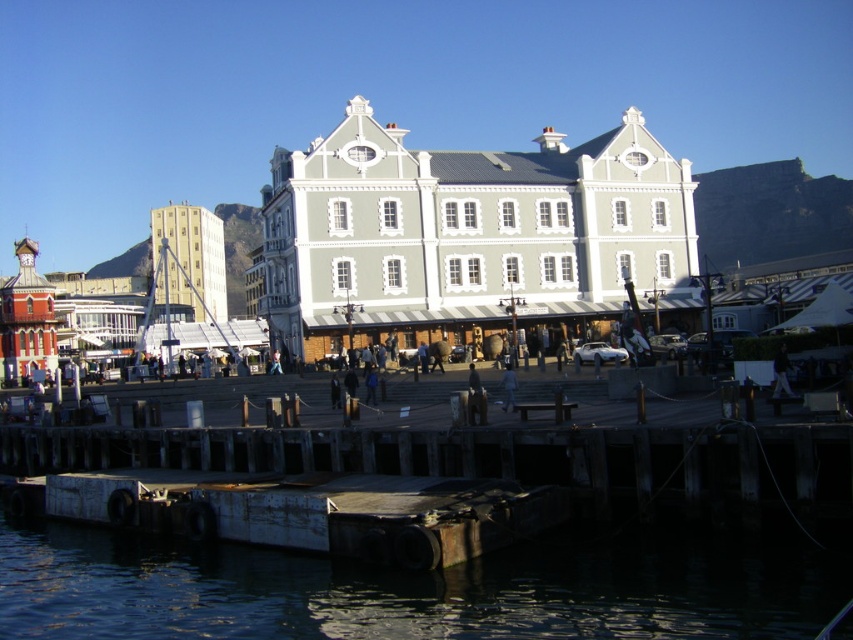
Which is below, dark gray water at lower left or rusty metal dock at lower center?

Positioned lower is dark gray water at lower left.

At what (x,y) coordinates should I click in order to perform the action: click on dark gray water at lower left. Please return your answer as a coordinate pair (x, y). The width and height of the screenshot is (853, 640). Looking at the image, I should click on (418, 588).

At what (x,y) coordinates should I click in order to perform the action: click on dark gray water at lower left. Please return your answer as a coordinate pair (x, y). This screenshot has width=853, height=640. Looking at the image, I should click on (418, 588).

Is dark gray water at lower left smaller than dark blue fabric at center?

Incorrect, dark gray water at lower left is not smaller in size than dark blue fabric at center.

Identify the location of dark gray water at lower left. This screenshot has width=853, height=640. (418, 588).

This screenshot has height=640, width=853. What are the coordinates of `dark gray water at lower left` in the screenshot? It's located at (418, 588).

The image size is (853, 640). In order to click on dark gray water at lower left in this screenshot , I will do `click(418, 588)`.

Which of these two, rusty metal dock at lower center or dark gray jacket at center, stands taller?

rusty metal dock at lower center is taller.

Between point (184, 500) and point (776, 380), which one is positioned in front?

Point (184, 500) is in front.

The height and width of the screenshot is (640, 853). In order to click on rusty metal dock at lower center in this screenshot , I will do `click(320, 513)`.